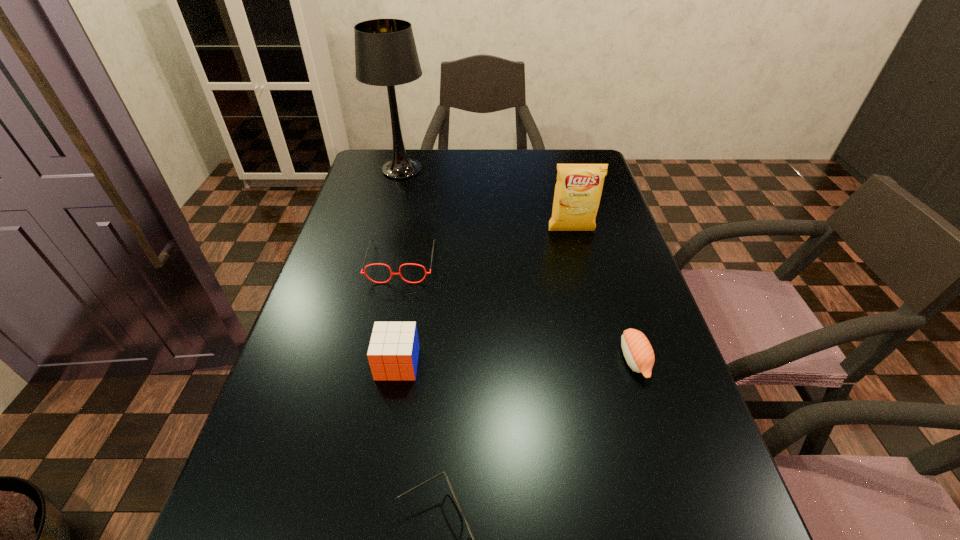
Where is `vacant region located 0.170m on the front of the cube`? vacant region located 0.170m on the front of the cube is located at coordinates (380, 467).

Identify the location of vacant area located 0.380m on the front-facing side of the fourth nearest object. (368, 431).

Identify the location of free space located on the back of the sushi. This screenshot has width=960, height=540. (613, 291).

Locate an element on the screen. This screenshot has width=960, height=540. object that is positioned at the far edge is located at coordinates (385, 51).

Where is `table lamp that is at the left edge`? table lamp that is at the left edge is located at coordinates (385, 51).

Identify the location of spectacles that is positioned at the left edge. Image resolution: width=960 pixels, height=540 pixels. (364, 272).

What are the coordinates of `crisp (potato chip) that is positioned at the right edge` in the screenshot? It's located at (578, 189).

Identify the location of sushi positioned at the right edge. (637, 350).

Find the location of a particular element. The width and height of the screenshot is (960, 540). object at the far left corner is located at coordinates (385, 51).

You are a GUI agent. You are given a task and a screenshot of the screen. Output one action in this format:
    pyautogui.click(x=<x>, y=<y>)
    Task: Click on the blank area at the far edge
    The width and height of the screenshot is (960, 540).
    Given the screenshot: What is the action you would take?
    pyautogui.click(x=542, y=154)